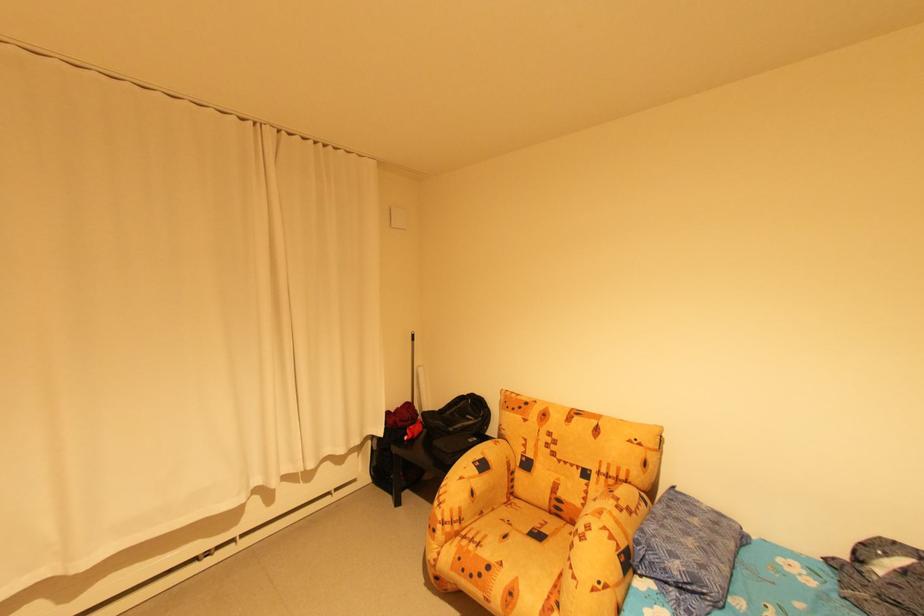
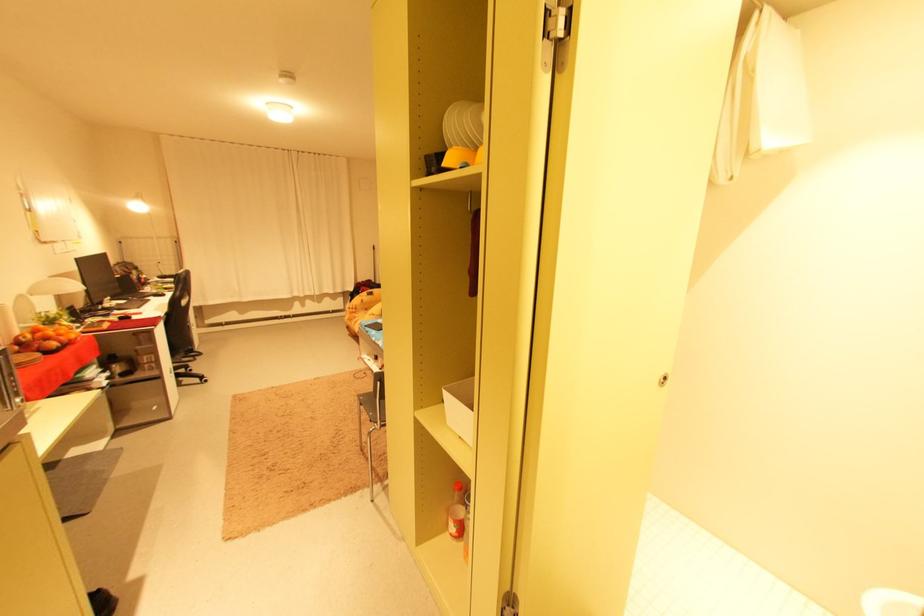
In a continuous first-person perspective shot, in which direction is the camera moving?

The cameraman moved toward right, backward.